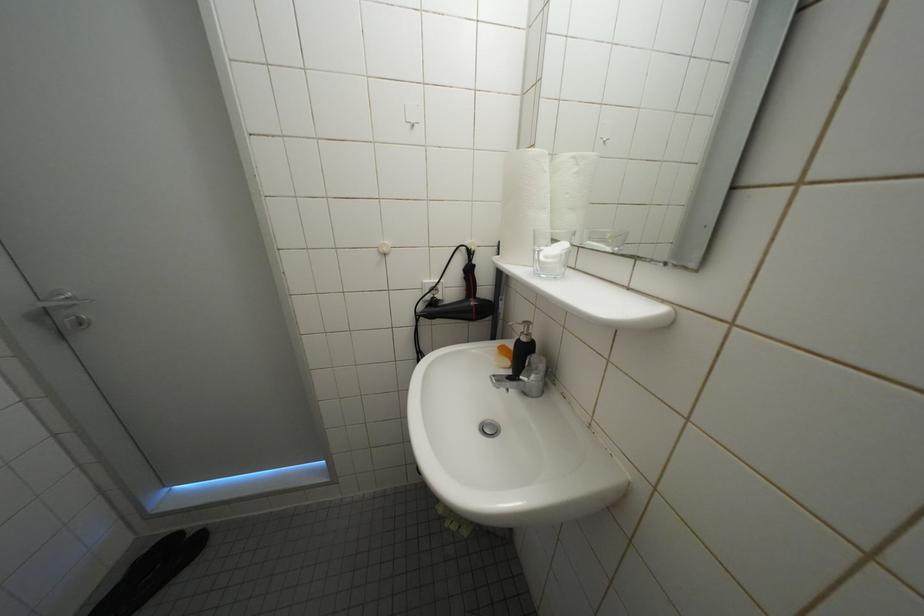
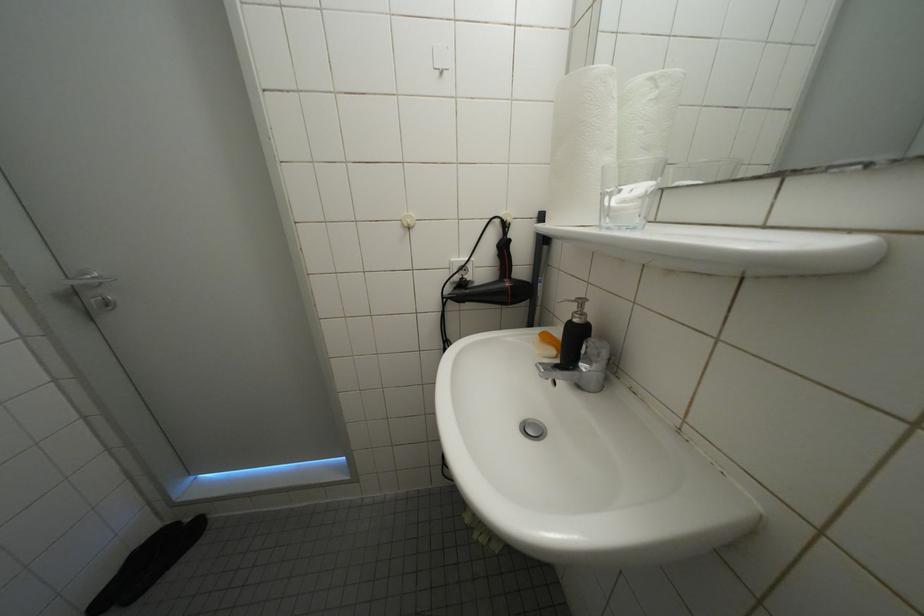
Question: How did the camera likely rotate?

Choices:
 (A) Left
 (B) Right
 (C) Up
 (D) Down

Answer: (A)